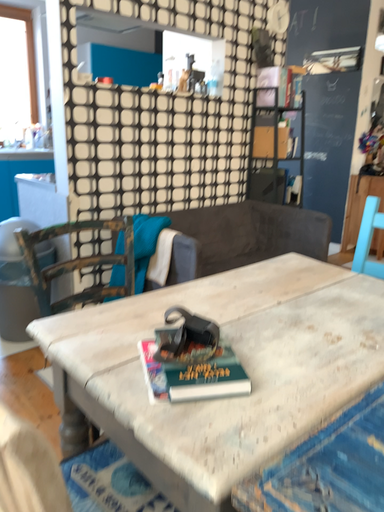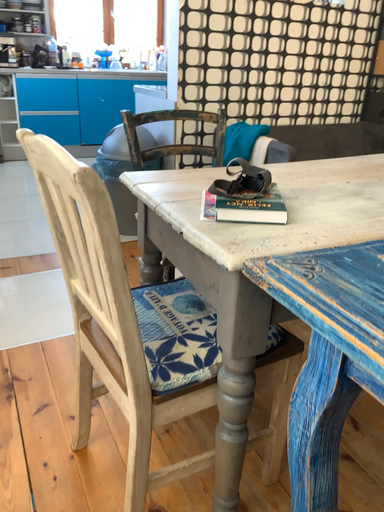
Question: How did the camera likely rotate when shooting the video?

Choices:
 (A) rotated right
 (B) rotated left

Answer: (B)